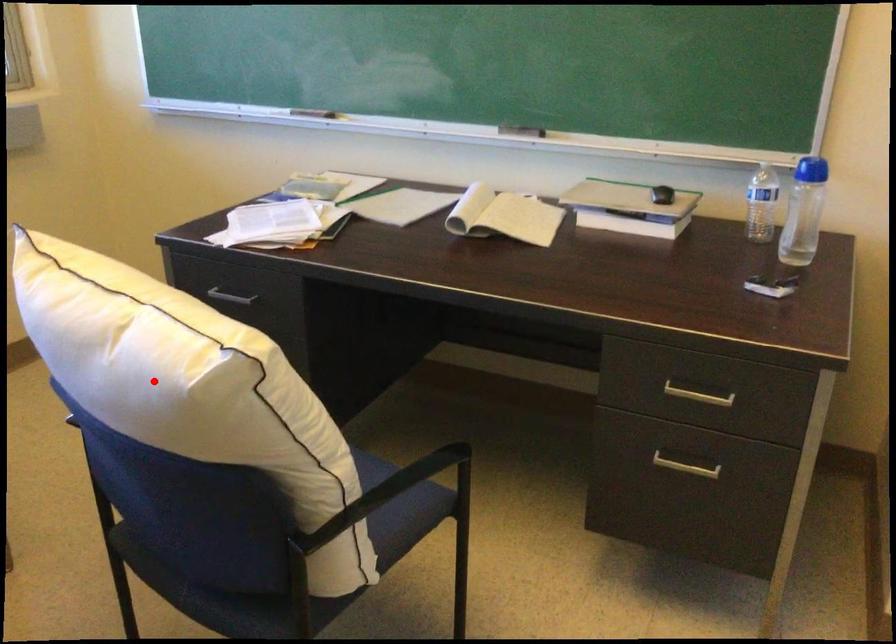
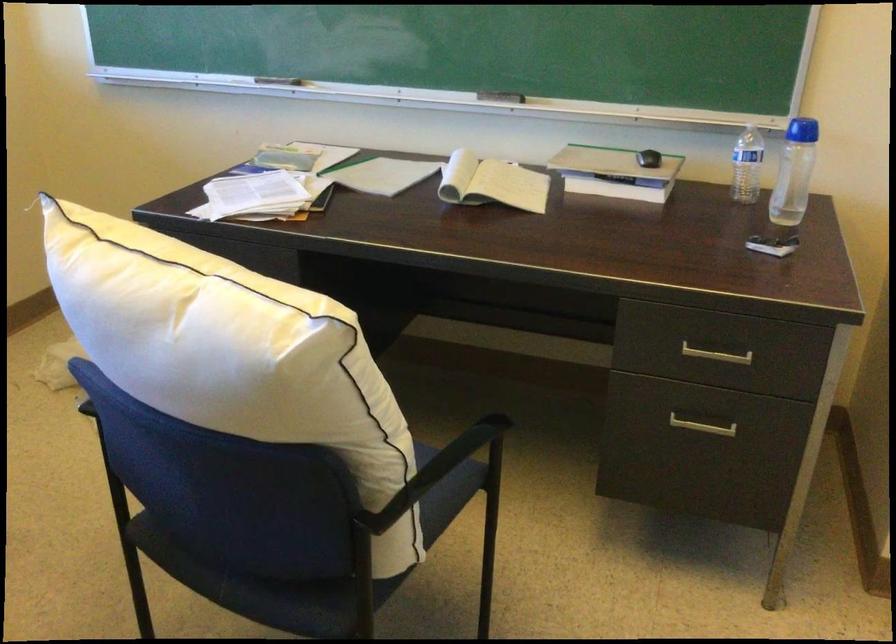
In the second image, find the point that corresponds to the highlighted location in the first image.

(231, 353)